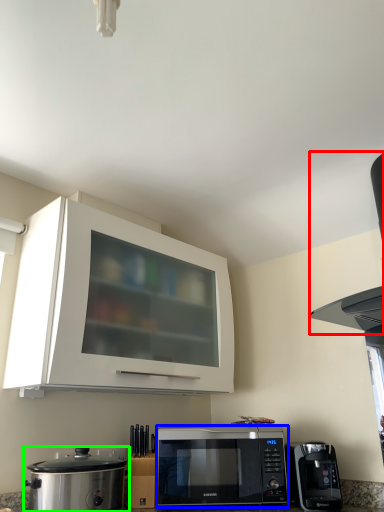
Question: Which is farther away from vent (highlighted by a red box)? microwave oven (highlighted by a blue box) or home appliance (highlighted by a green box)?

Choices:
 (A) microwave oven
 (B) home appliance

Answer: (B)